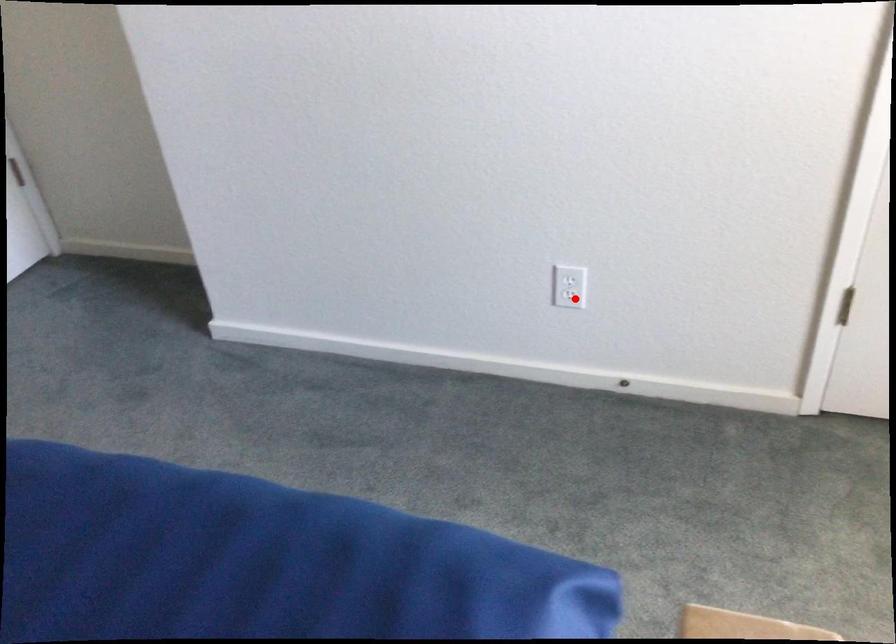
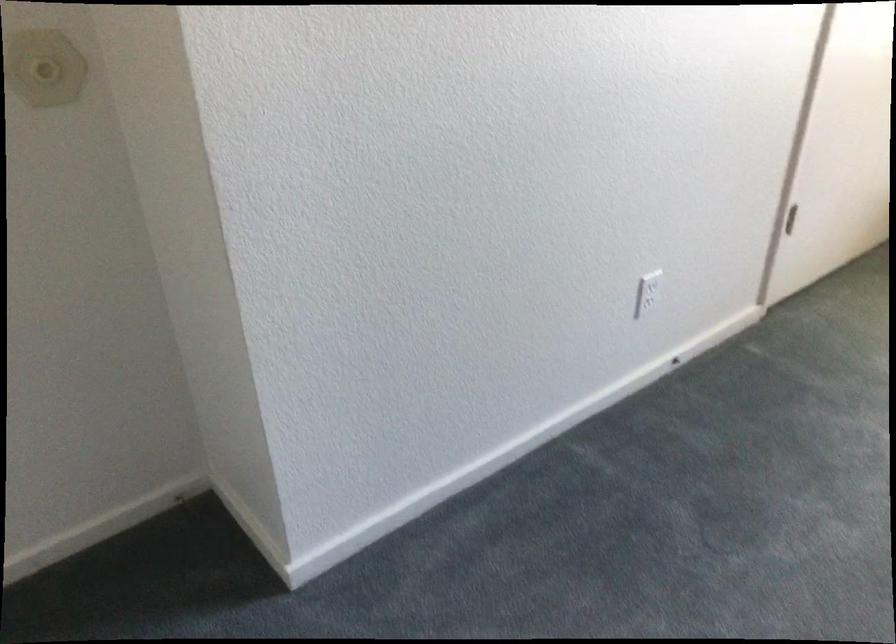
Question: I am providing you with two images of the same scene from different viewpoints. A red point is marked on the first image. At the location where the point appears in image 1, is it still visible in image 2?

Choices:
 (A) Yes
 (B) No

Answer: (A)